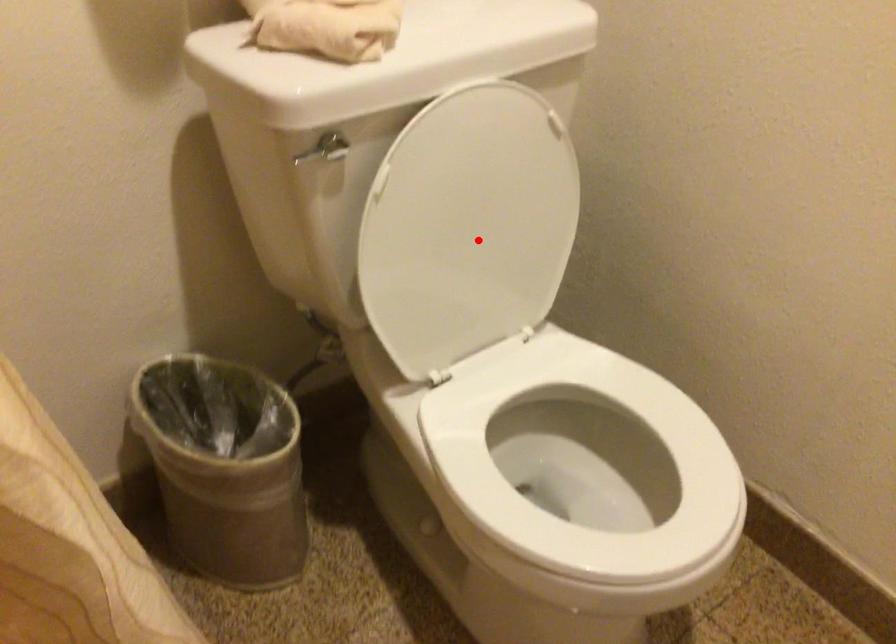
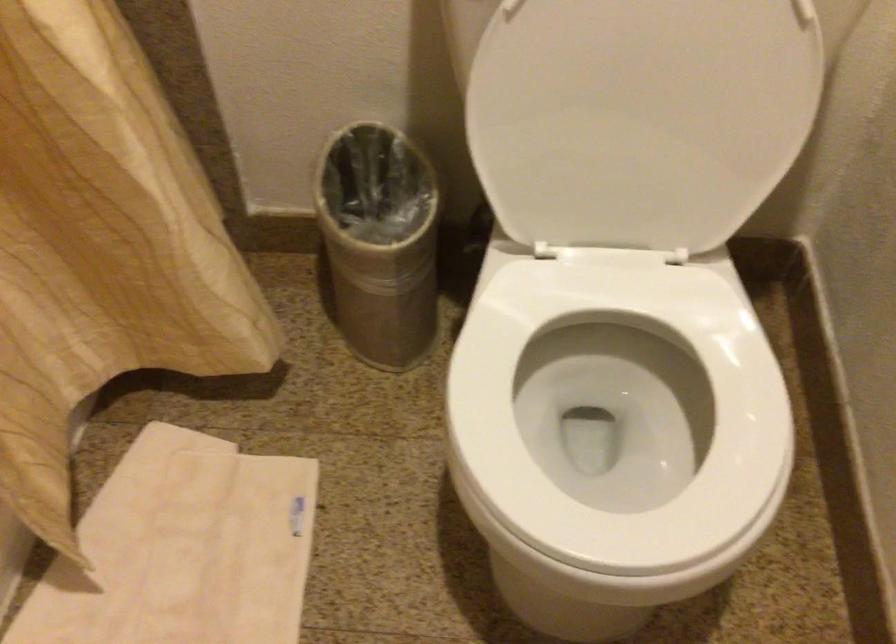
Find the pixel in the second image that matches the highlighted location in the first image.

(640, 118)